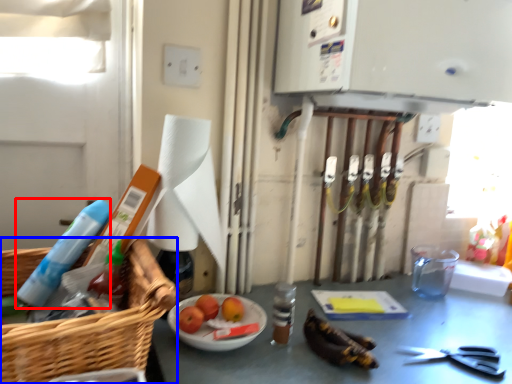
Question: Which object is further to the camera taking this photo, cleaning product (highlighted by a red box) or basket (highlighted by a blue box)?

Choices:
 (A) cleaning product
 (B) basket

Answer: (A)